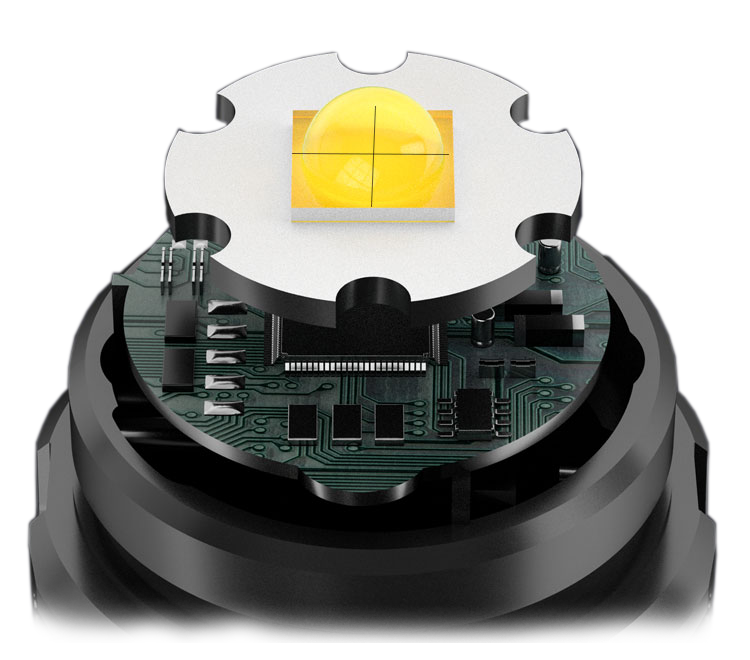
Where is `yellow bulb`? The height and width of the screenshot is (660, 750). yellow bulb is located at coordinates (405, 119).